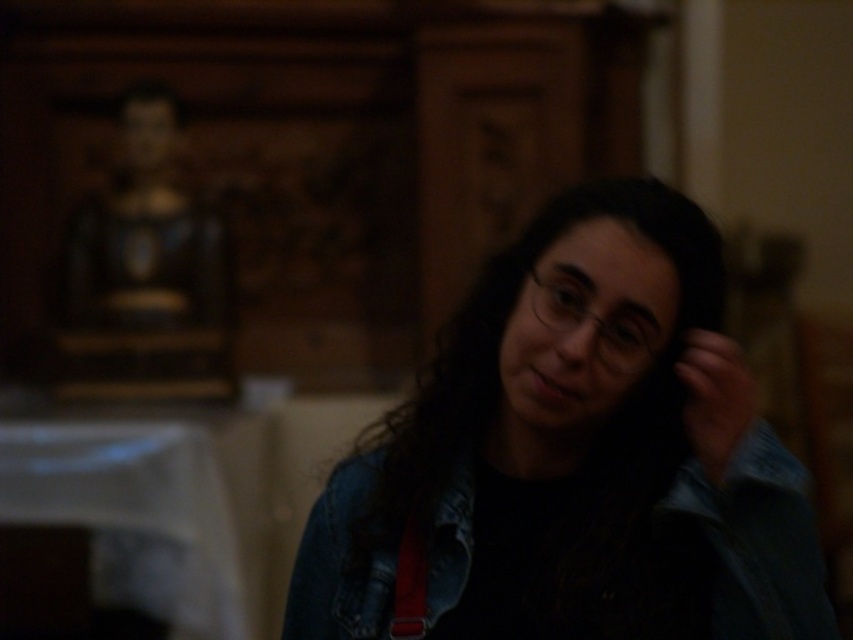
You are an interior designer assessing the layout of this room. You need to determine the spatial relationship between the wooden statue at upper left and the matte black hand at right. Which object is located to the left of the other?

The wooden statue at upper left is positioned on the left side of matte black hand at right, meaning the wooden statue at upper left is to the left of the matte black hand at right.

You are an interior designer assessing the placement of items in a room. You notice the wooden statue at upper left and the matte black hand at right. Which object takes up more space in the scene?

The wooden statue at upper left is larger in size than the matte black hand at right, so it takes up more space in the scene.

You are a photographer setting up a shot in this dimly lit room. You want to ensure both the denim jacket at center and the wooden statue at upper left are in focus. Given that your camera has a depth of field of 10 feet, will both objects be in focus?

The denim jacket at center is 9.84 feet away from the wooden statue at upper left. Since the distance between them is within the camera depth of field of 10 feet, both objects will be in focus.